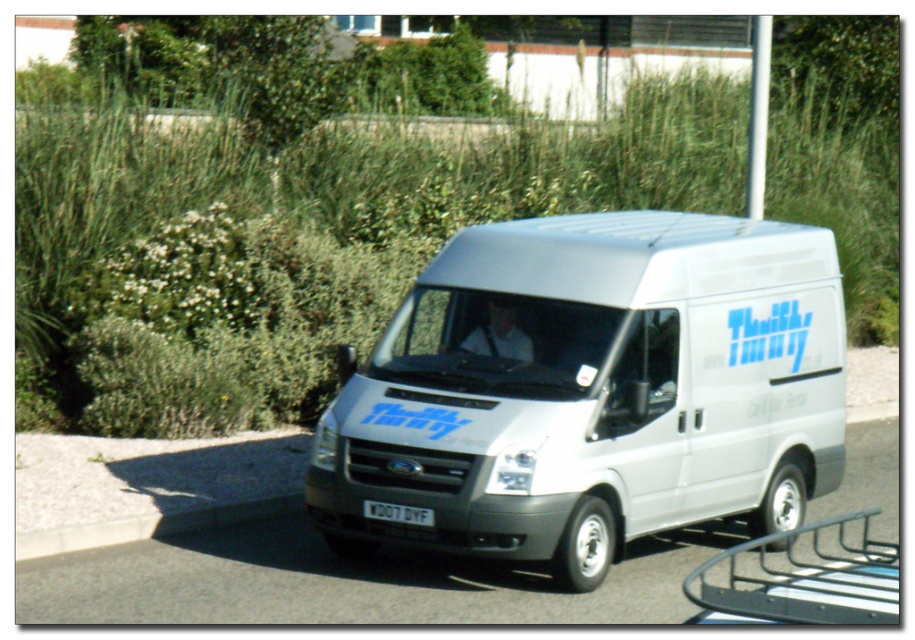
You are a delivery driver who needs to park your white matte van at center near the black metal bike rack at lower right. The parking space between them is only 4 meters wide. Can your van fit into that space without hitting the bike rack?

The white matte van at center is 4.61 meters from the black metal bike rack at lower right. Since the parking space is only 4 meters wide, the van cannot fit without hitting the bike rack.

You are standing in front of the white Ford Transit van parked in the parking lot. There are two points marked on the van. One is at coordinate point (750, 582) and the other is at point (130, 525). Which point is closer to you?

The point at coordinate (750, 582) is closer to the camera than the point at (130, 525).